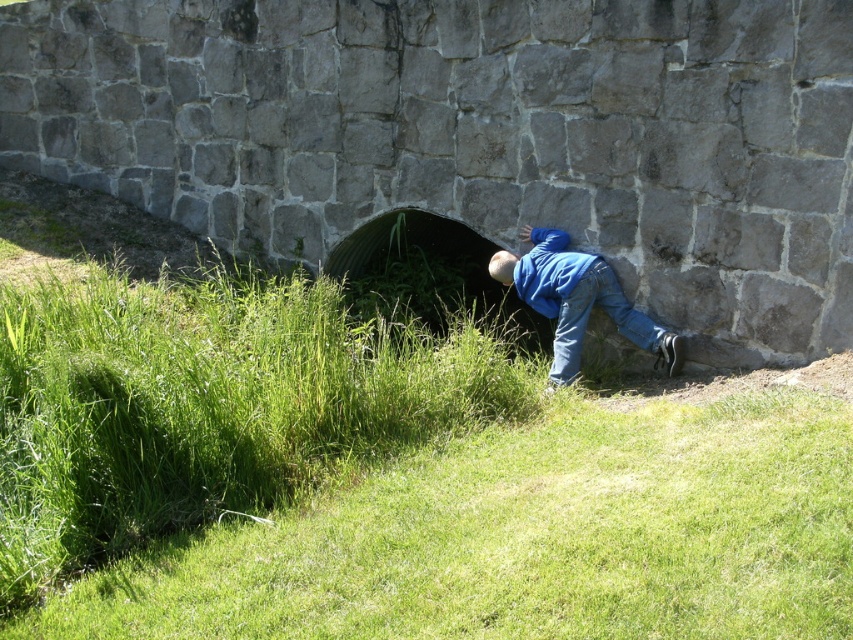
Who is higher up, green grass at lower left or green corrugated metal tunnel at center?

green corrugated metal tunnel at center

Locate an element on the screen. green grass at lower left is located at coordinates (531, 532).

Where is `green grass at lower left`? green grass at lower left is located at coordinates (531, 532).

The width and height of the screenshot is (853, 640). I want to click on green grass at lower left, so click(531, 532).

Is point (479, 305) positioned before point (593, 298)?

No.

Describe the element at coordinates (427, 273) in the screenshot. I see `green corrugated metal tunnel at center` at that location.

The image size is (853, 640). Find the location of `green corrugated metal tunnel at center`. green corrugated metal tunnel at center is located at coordinates (427, 273).

Who is positioned more to the left, green corrugated metal tunnel at center or blue denim jeans at lower center?

From the viewer's perspective, green corrugated metal tunnel at center appears more on the left side.

Can you confirm if green corrugated metal tunnel at center is taller than blue denim jeans at lower center?

Indeed, green corrugated metal tunnel at center has a greater height compared to blue denim jeans at lower center.

The width and height of the screenshot is (853, 640). Describe the element at coordinates (427, 273) in the screenshot. I see `green corrugated metal tunnel at center` at that location.

Locate an element on the screen. This screenshot has width=853, height=640. green corrugated metal tunnel at center is located at coordinates (427, 273).